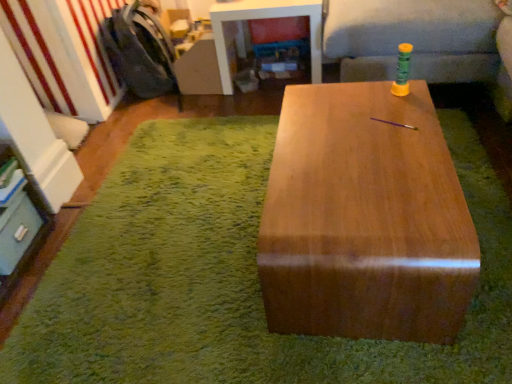
This screenshot has height=384, width=512. Find the location of `satin wood table at center, marked as the second table in a back-to-front arrangement`. satin wood table at center, marked as the second table in a back-to-front arrangement is located at coordinates (365, 218).

Where is `glossy wood table at center, marked as the 1th table in a top-to-bottom arrangement`? glossy wood table at center, marked as the 1th table in a top-to-bottom arrangement is located at coordinates (263, 18).

I want to click on satin wood table at center, arranged as the 1th table when ordered from the bottom, so click(365, 218).

From the image's perspective, is matte gray drawer at lower left on top of wooden table at center?

No, from the image's perspective, matte gray drawer at lower left is not over wooden table at center.

Between point (1, 254) and point (38, 287), which one is positioned in front?

Point (1, 254)

Is matte gray drawer at lower left far from wooden table at center?

Actually, matte gray drawer at lower left and wooden table at center are a little close together.

Is wooden table at center at the back of matte gray drawer at lower left?

No, matte gray drawer at lower left is not facing the opposite direction of wooden table at center.

From the image's perspective, is glossy wood table at center, which ranks as the 2th table in bottom-to-top order, above or below matte gray drawer at lower left?

Clearly, from the image's perspective, glossy wood table at center, which ranks as the 2th table in bottom-to-top order, is above matte gray drawer at lower left.

Are glossy wood table at center, which is counted as the 2th table, starting from the front, and matte gray drawer at lower left beside each other?

They are not placed beside each other.

Which point is more distant from viewer, (282,13) or (12,218)?

The point (282,13) is behind.

Based on the photo, could you measure the distance between glossy wood table at center, which ranks as the 1th table in back-to-front order, and matte gray drawer at lower left?

A distance of 1.38 meters exists between glossy wood table at center, which ranks as the 1th table in back-to-front order, and matte gray drawer at lower left.

Does matte gray drawer at lower left have a greater height compared to dark gray fabric armchair at left?

No, matte gray drawer at lower left is not taller than dark gray fabric armchair at left.

Is matte gray drawer at lower left in contact with dark gray fabric armchair at left?

No, matte gray drawer at lower left is not beside dark gray fabric armchair at left.

Can you confirm if matte gray drawer at lower left is smaller than dark gray fabric armchair at left?

Yes.

From the picture: Does glossy wood table at center, which ranks as the 2th table in bottom-to-top order, have a lesser height compared to wooden table at center?

Incorrect, the height of glossy wood table at center, which ranks as the 2th table in bottom-to-top order, does not fall short of that of wooden table at center.

From a real-world perspective, is glossy wood table at center, which ranks as the 2th table in bottom-to-top order, physically above wooden table at center?

Indeed, from a real-world perspective, glossy wood table at center, which ranks as the 2th table in bottom-to-top order, stands above wooden table at center.

Can you confirm if glossy wood table at center, which ranks as the 2th table in bottom-to-top order, is wider than wooden table at center?

No, glossy wood table at center, which ranks as the 2th table in bottom-to-top order, is not wider than wooden table at center.

Is matte gray drawer at lower left thinner than satin wood table at center, the 1th table when ordered from front to back?

Correct, the width of matte gray drawer at lower left is less than that of satin wood table at center, the 1th table when ordered from front to back.

Is matte gray drawer at lower left not close to satin wood table at center, the 1th table when ordered from front to back?

That's right, there is a large distance between matte gray drawer at lower left and satin wood table at center, the 1th table when ordered from front to back.

Which is correct: matte gray drawer at lower left is inside satin wood table at center, acting as the 2th table starting from the top, or outside of it?

matte gray drawer at lower left is not inside satin wood table at center, acting as the 2th table starting from the top, it's outside.

In the scene shown: From a real-world perspective, is matte gray drawer at lower left on top of satin wood table at center, acting as the 2th table starting from the top?

No, from a real-world perspective, matte gray drawer at lower left is not above satin wood table at center, acting as the 2th table starting from the top.

Is green fabric couch at upper right far from dark gray fabric armchair at left?

Yes, green fabric couch at upper right and dark gray fabric armchair at left are quite far apart.

Is dark gray fabric armchair at left a part of green fabric couch at upper right?

Definitely not — dark gray fabric armchair at left is not inside green fabric couch at upper right.

From a real-world perspective, between green fabric couch at upper right and dark gray fabric armchair at left, who is vertically higher?

From a 3D spatial view, green fabric couch at upper right is above.

Does glossy wood table at center, marked as the 1th table in a top-to-bottom arrangement, appear on the left side of green fabric couch at upper right?

Yes, glossy wood table at center, marked as the 1th table in a top-to-bottom arrangement, is to the left of green fabric couch at upper right.

From a real-world perspective, is glossy wood table at center, which is counted as the 2th table, starting from the front, above or below green fabric couch at upper right?

From a real-world perspective, glossy wood table at center, which is counted as the 2th table, starting from the front, is physically below green fabric couch at upper right.

Which is behind, glossy wood table at center, marked as the 1th table in a top-to-bottom arrangement, or green fabric couch at upper right?

glossy wood table at center, marked as the 1th table in a top-to-bottom arrangement.

Does glossy wood table at center, marked as the 1th table in a top-to-bottom arrangement, turn towards green fabric couch at upper right?

No, glossy wood table at center, marked as the 1th table in a top-to-bottom arrangement, does not turn towards green fabric couch at upper right.

Locate an element on the screen. drawer that appears behind the wooden table at center is located at coordinates (17, 231).

Starting from the matte gray drawer at lower left, which table is the 1st one to the right? Please provide its 2D coordinates.

[(263, 18)]

Estimate the real-world distances between objects in this image. Which object is further from dark gray fabric armchair at left, wooden table at center or green fabric couch at upper right?

green fabric couch at upper right.

Looking at the image, which one is located closer to satin wood table at center, marked as the second table in a back-to-front arrangement, wooden table at center or matte gray drawer at lower left?

wooden table at center.

Which object lies further to the anchor point glossy wood table at center, which is counted as the 2th table, starting from the front, dark gray fabric armchair at left or wooden table at center?

Based on the image, wooden table at center appears to be further to glossy wood table at center, which is counted as the 2th table, starting from the front.

Based on the photo, from the image, which object appears to be farther from satin wood table at center, arranged as the 1th table when ordered from the bottom, glossy wood table at center, marked as the 1th table in a top-to-bottom arrangement, or dark gray fabric armchair at left?

dark gray fabric armchair at left.

Looking at the image, which one is located closer to satin wood table at center, arranged as the 1th table when ordered from the bottom, green fabric couch at upper right or matte gray drawer at lower left?

The object closer to satin wood table at center, arranged as the 1th table when ordered from the bottom, is green fabric couch at upper right.

When comparing their distances from glossy wood table at center, which is counted as the 2th table, starting from the front, does matte gray drawer at lower left or wooden table at center seem closer?

wooden table at center is closer to glossy wood table at center, which is counted as the 2th table, starting from the front.

Estimate the real-world distances between objects in this image. Which object is further from matte gray drawer at lower left, satin wood table at center, marked as the second table in a back-to-front arrangement, or glossy wood table at center, marked as the 1th table in a top-to-bottom arrangement?

glossy wood table at center, marked as the 1th table in a top-to-bottom arrangement, lies further to matte gray drawer at lower left than the other object.

From the image, which object appears to be farther from matte gray drawer at lower left, satin wood table at center, the 1th table when ordered from front to back, or wooden table at center?

The object further to matte gray drawer at lower left is satin wood table at center, the 1th table when ordered from front to back.

This screenshot has height=384, width=512. In order to click on armchair between glossy wood table at center, which is counted as the 2th table, starting from the front, and matte gray drawer at lower left vertically in this screenshot , I will do `click(140, 52)`.

I want to click on table between satin wood table at center, acting as the 2th table starting from the top, and dark gray fabric armchair at left, along the z-axis, so click(x=263, y=18).

Find the location of `armchair located between matte gray drawer at lower left and green fabric couch at upper right in the left-right direction`. armchair located between matte gray drawer at lower left and green fabric couch at upper right in the left-right direction is located at coordinates (140, 52).

You are a GUI agent. You are given a task and a screenshot of the screen. Output one action in this format:
    pyautogui.click(x=<x>, y=<y>)
    Task: Click on the mat that lies between glossy wood table at center, which ranks as the 2th table in bottom-to-top order, and matte gray drawer at lower left from top to bottom
    The height and width of the screenshot is (384, 512).
    Given the screenshot: What is the action you would take?
    pyautogui.click(x=229, y=277)